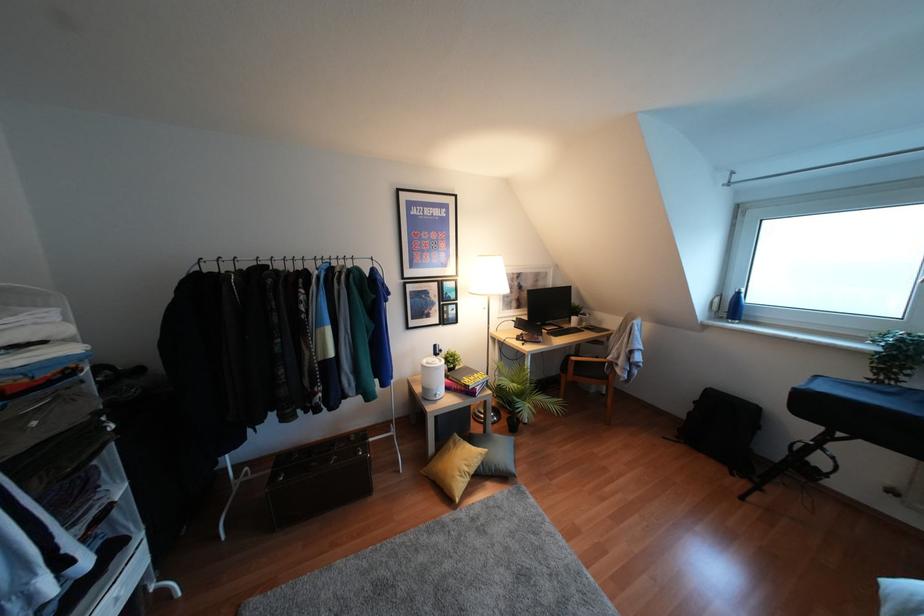
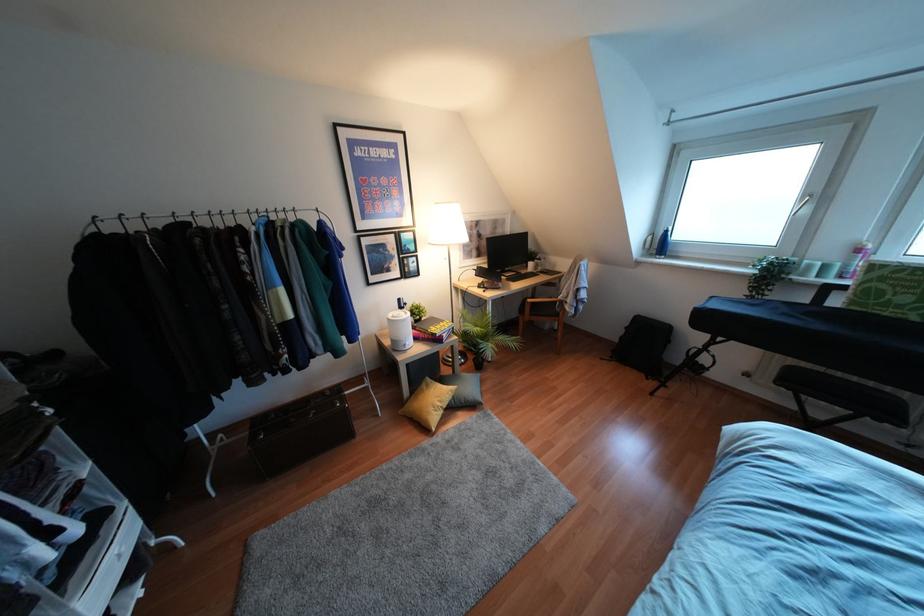
Find the pixel in the second image that matches (x=732, y=308) in the first image.

(660, 245)